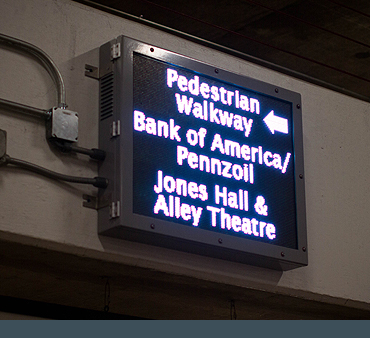
Where is `hook`? hook is located at coordinates (91, 202), (93, 66).